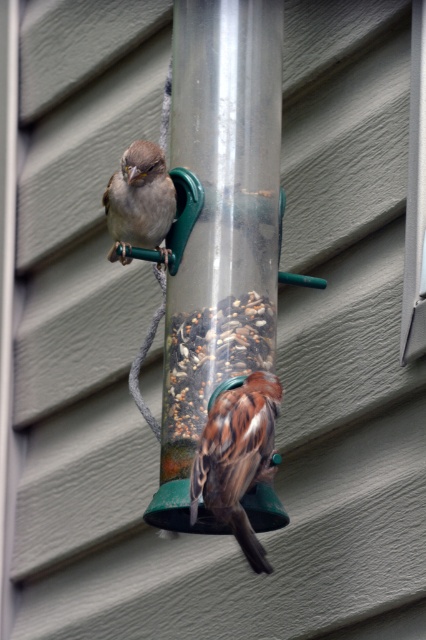
You are a birdwatcher trying to identify birds in the image. You notice two birds on the feeder. Which one has a larger size between the brown speckled feathers at center and the matte brown sparrow at upper left?

The brown speckled feathers at center is bigger than the matte brown sparrow at upper left.

You are a birdwatcher trying to identify the birds in the image. You notice two birds on the feeder. The first is the brown speckled feathers at center and the second is the matte brown sparrow at upper left. Based on their positions, which bird is closer to the camera?

The brown speckled feathers at center is closer to the camera because it is positioned at the center, which is typically the focal point in such scenes, making it appear more prominent and nearer compared to the matte brown sparrow at upper left.